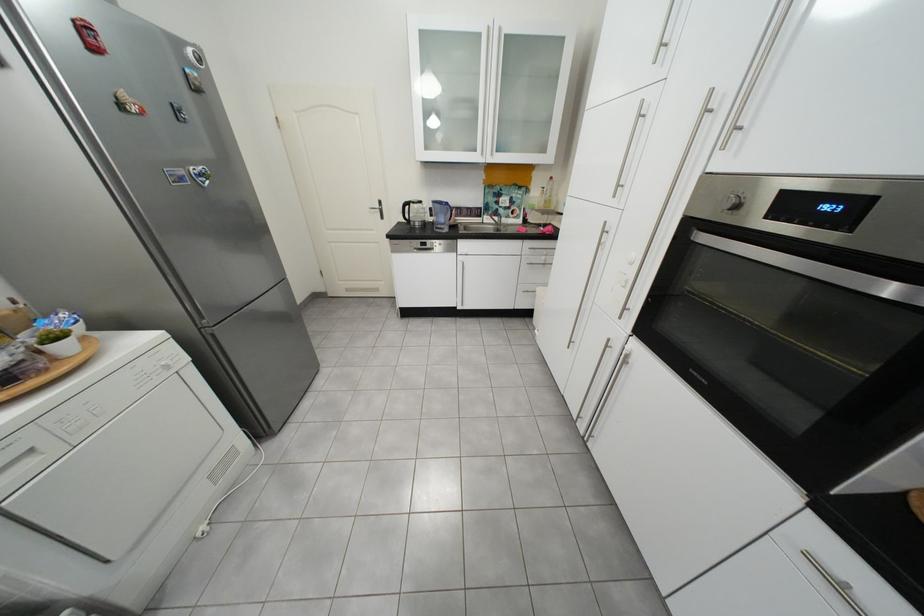
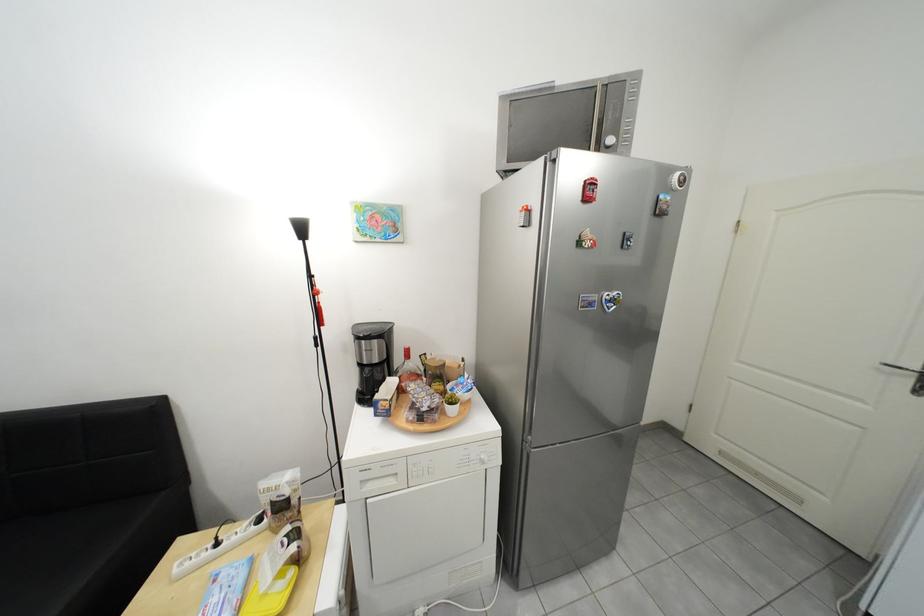
Question: The first image is from the beginning of the video and the second image is from the end. How did the camera likely rotate when shooting the video?

Choices:
 (A) Left
 (B) Right
 (C) Up
 (D) Down

Answer: (A)